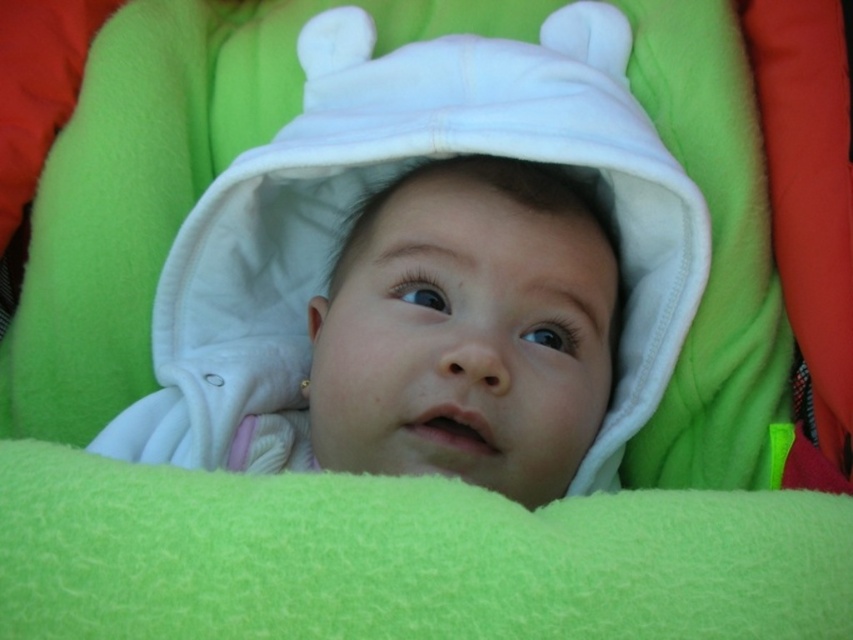
Question: Does green fleece blanket at center appear over white fleece baby at center?

Choices:
 (A) no
 (B) yes

Answer: (A)

Question: Is green fleece blanket at center below white fleece baby at center?

Choices:
 (A) yes
 (B) no

Answer: (A)

Question: Can you confirm if green fleece blanket at center is thinner than white fleece baby at center?

Choices:
 (A) no
 (B) yes

Answer: (A)

Question: Which point is closer to the camera?

Choices:
 (A) white fleece baby at center
 (B) green fleece blanket at center

Answer: (B)